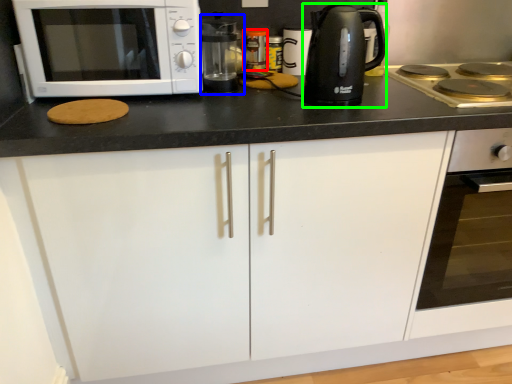
Question: Which object is the closest to the appliance (highlighted by a red box)? Choose among these: coffee machine (highlighted by a blue box) or kitchen appliance (highlighted by a green box).

Choices:
 (A) coffee machine
 (B) kitchen appliance

Answer: (A)